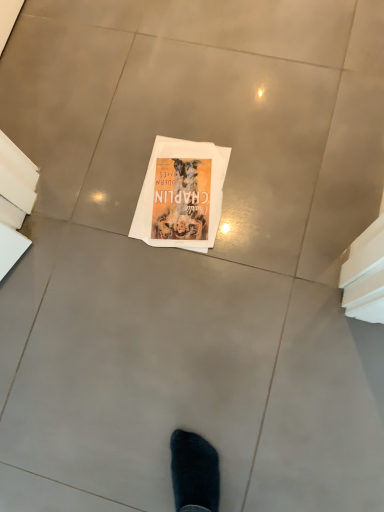
You are a GUI agent. You are given a task and a screenshot of the screen. Output one action in this format:
    pyautogui.click(x=<x>, y=<y>)
    Task: Click on the vacant space situated above matte paper book at center (from a real-world perspective)
    
    Given the screenshot: What is the action you would take?
    pyautogui.click(x=172, y=186)